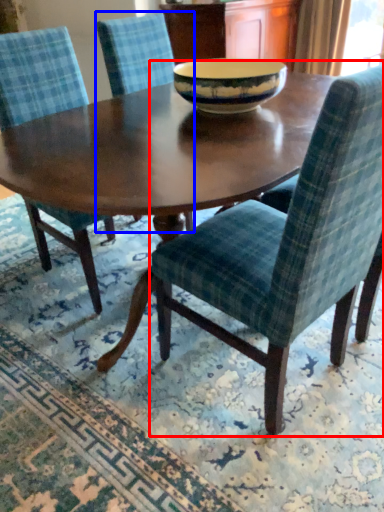
Question: Among these objects, which one is nearest to the camera, chair (highlighted by a red box) or chair (highlighted by a blue box)?

Choices:
 (A) chair
 (B) chair

Answer: (A)